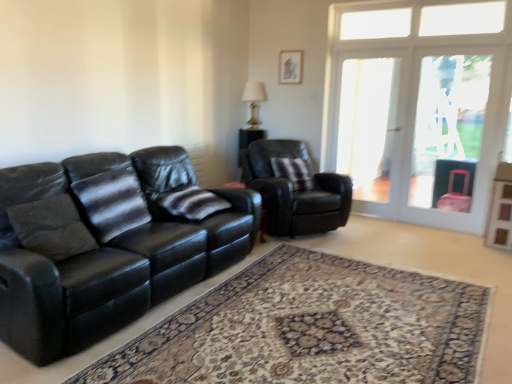
Question: Is striped fabric pillow at center, the 2th pillow viewed from the left, surrounding striped fabric pillow at center, the third pillow from the left?

Choices:
 (A) no
 (B) yes

Answer: (A)

Question: From the image's perspective, does striped fabric pillow at center, the 2th pillow viewed from the left, appear higher than striped fabric pillow at center, which appears as the 1th pillow when viewed from the back?

Choices:
 (A) no
 (B) yes

Answer: (A)

Question: Can you confirm if striped fabric pillow at center, placed as the second pillow when sorted from front to back, is thinner than striped fabric pillow at center, the third pillow from the left?

Choices:
 (A) yes
 (B) no

Answer: (B)

Question: Is striped fabric pillow at center, placed as the second pillow when sorted from front to back, not near striped fabric pillow at center, marked as the 1th pillow in a right-to-left arrangement?

Choices:
 (A) yes
 (B) no

Answer: (A)

Question: Could you tell me if striped fabric pillow at center, which is the 2th pillow in right-to-left order, is facing striped fabric pillow at center, which appears as the 1th pillow when viewed from the back?

Choices:
 (A) yes
 (B) no

Answer: (B)

Question: Is striped fabric pillow at center, the 2th pillow viewed from the left, taller than striped fabric pillow at center, which appears as the 1th pillow when viewed from the back?

Choices:
 (A) no
 (B) yes

Answer: (A)

Question: Is matte glass lamp at upper center positioned before black leather couch at left?

Choices:
 (A) yes
 (B) no

Answer: (B)

Question: Is matte glass lamp at upper center looking in the opposite direction of black leather couch at left?

Choices:
 (A) no
 (B) yes

Answer: (A)

Question: Is matte glass lamp at upper center positioned behind black leather couch at left?

Choices:
 (A) yes
 (B) no

Answer: (A)

Question: Is matte glass lamp at upper center thinner than black leather couch at left?

Choices:
 (A) no
 (B) yes

Answer: (B)

Question: Is matte glass lamp at upper center oriented towards black leather couch at left?

Choices:
 (A) yes
 (B) no

Answer: (A)

Question: From a real-world perspective, is matte glass lamp at upper center below black leather couch at left?

Choices:
 (A) yes
 (B) no

Answer: (B)

Question: Is striped fabric pillow at center, the 2th pillow positioned from the back, in front of carpeted rug at center?

Choices:
 (A) no
 (B) yes

Answer: (A)